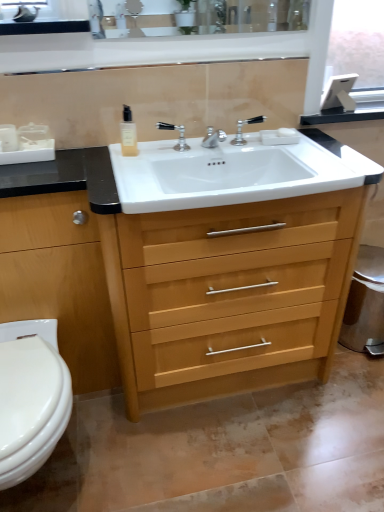
You are a GUI agent. You are given a task and a screenshot of the screen. Output one action in this format:
    pyautogui.click(x=<x>, y=<y>)
    Task: Click on the vacant space in front of polished chrome faucet at center, the first tap in the left-to-right sequence
    This screenshot has height=512, width=384.
    Given the screenshot: What is the action you would take?
    pyautogui.click(x=147, y=167)